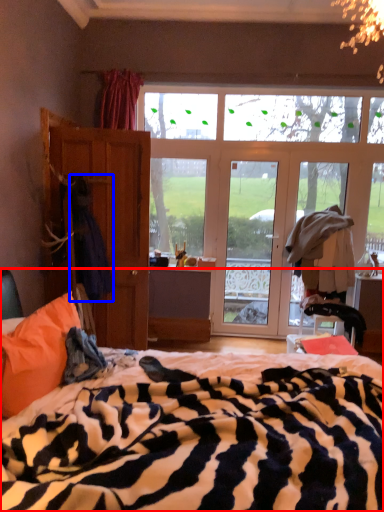
Question: Which object is further to the camera taking this photo, bed (highlighted by a red box) or laundry (highlighted by a blue box)?

Choices:
 (A) bed
 (B) laundry

Answer: (B)